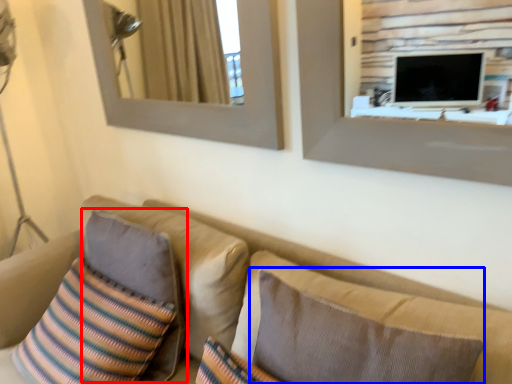
Question: Which of the following is the closest to the observer, pillow (highlighted by a red box) or pillow (highlighted by a blue box)?

Choices:
 (A) pillow
 (B) pillow

Answer: (B)